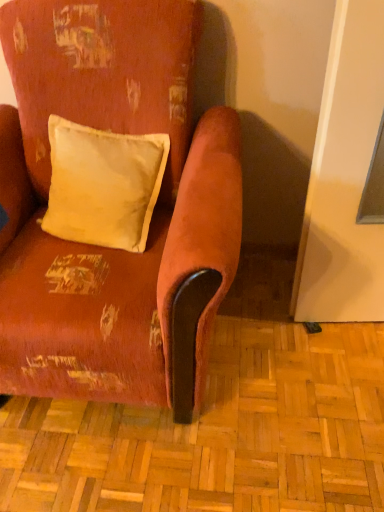
Question: Can you confirm if matte yellow cushion at upper left is positioned to the right of distressed velvet armchair at center?

Choices:
 (A) no
 (B) yes

Answer: (B)

Question: Can you confirm if matte yellow cushion at upper left is taller than distressed velvet armchair at center?

Choices:
 (A) yes
 (B) no

Answer: (B)

Question: Is the depth of matte yellow cushion at upper left greater than that of distressed velvet armchair at center?

Choices:
 (A) no
 (B) yes

Answer: (B)

Question: From a real-world perspective, does matte yellow cushion at upper left stand above distressed velvet armchair at center?

Choices:
 (A) yes
 (B) no

Answer: (A)

Question: From the image's perspective, is matte yellow cushion at upper left located above distressed velvet armchair at center?

Choices:
 (A) no
 (B) yes

Answer: (B)

Question: Is matte yellow cushion at upper left to the left of distressed velvet armchair at center from the viewer's perspective?

Choices:
 (A) yes
 (B) no

Answer: (B)

Question: Is distressed velvet armchair at center not inside matte yellow cushion at upper left?

Choices:
 (A) yes
 (B) no

Answer: (A)

Question: Is distressed velvet armchair at center turned away from matte yellow cushion at upper left?

Choices:
 (A) yes
 (B) no

Answer: (A)

Question: Would you say distressed velvet armchair at center contains matte yellow cushion at upper left?

Choices:
 (A) no
 (B) yes

Answer: (B)

Question: Can you confirm if distressed velvet armchair at center is positioned to the right of matte yellow cushion at upper left?

Choices:
 (A) yes
 (B) no

Answer: (B)

Question: Is distressed velvet armchair at center smaller than matte yellow cushion at upper left?

Choices:
 (A) yes
 (B) no

Answer: (B)

Question: Can you confirm if distressed velvet armchair at center is positioned to the left of matte yellow cushion at upper left?

Choices:
 (A) yes
 (B) no

Answer: (A)

Question: From a real-world perspective, is matte yellow cushion at upper left above or below distressed velvet armchair at center?

Choices:
 (A) above
 (B) below

Answer: (A)